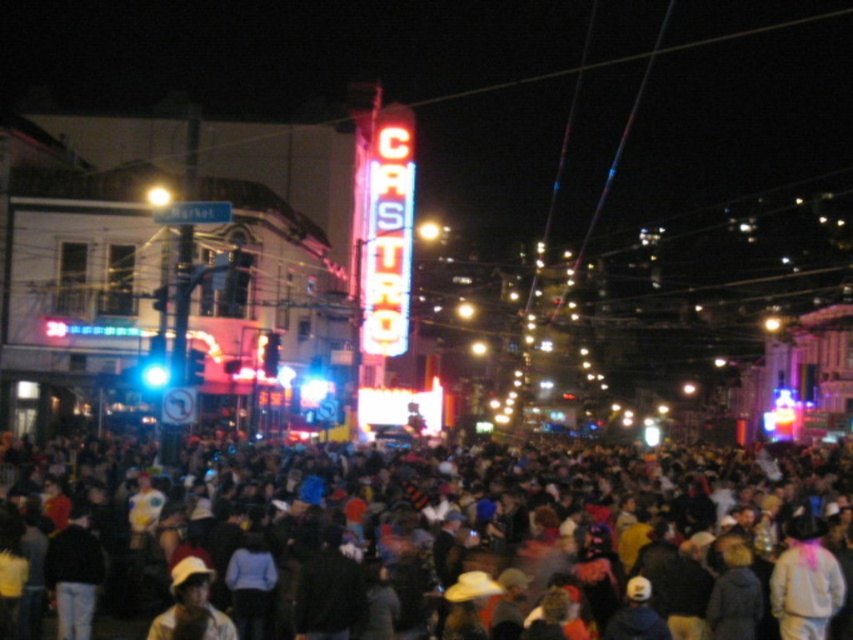
You are standing at the point marked by the coordinates point [497,545] in the image. What is the closest object to you in the scene?

The closest object to you at point [497,545] is the multicolored fabric crowd at center, as the coordinates provided directly correspond to its location.

You are a delivery drone operator who needs to fly a drone from the multicolored fabric crowd at center to the neon sign at center. The drone has a maximum flight distance of 100 feet. Can the drone make this delivery without needing to recharge?

The multicolored fabric crowd at center and neon sign at center are 110.68 feet apart from each other, so the drone cannot make the delivery without recharging as it exceeds the 100 feet limit.